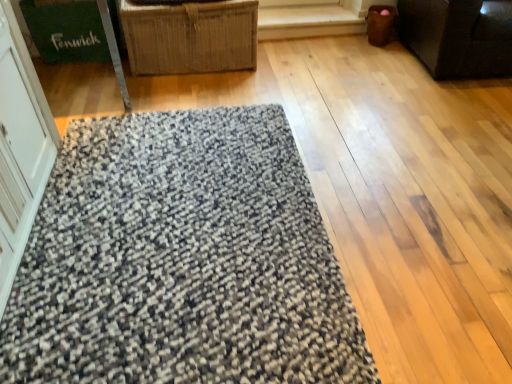
Identify the location of free space in front of green cardboard box at upper left. (76, 82).